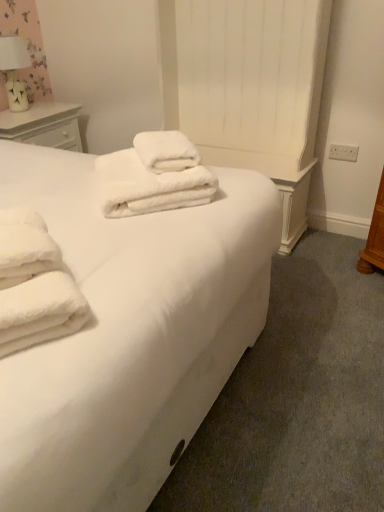
You are a GUI agent. You are given a task and a screenshot of the screen. Output one action in this format:
    pyautogui.click(x=<x>, y=<y>)
    Task: Click on the vacant region below white ceramic table lamp at upper left (from a real-world perspective)
    This screenshot has width=384, height=512.
    Given the screenshot: What is the action you would take?
    pyautogui.click(x=24, y=110)